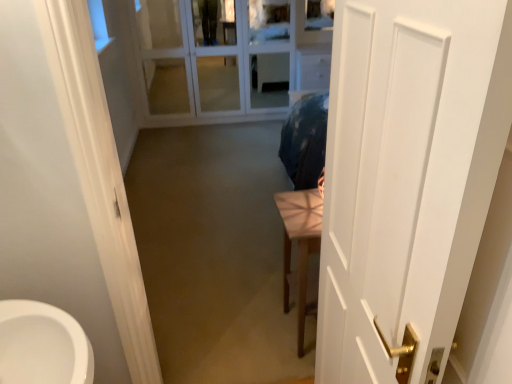
Question: Considering the relative positions of white matte door at right and light brown wooden table at center in the image provided, is white matte door at right in front of light brown wooden table at center?

Choices:
 (A) no
 (B) yes

Answer: (B)

Question: Considering the relative positions of white matte door at right and light brown wooden table at center in the image provided, is white matte door at right to the right of light brown wooden table at center from the viewer's perspective?

Choices:
 (A) no
 (B) yes

Answer: (B)

Question: Is light brown wooden table at center located within white matte door at right?

Choices:
 (A) yes
 (B) no

Answer: (B)

Question: From a real-world perspective, is white matte door at right positioned under light brown wooden table at center based on gravity?

Choices:
 (A) no
 (B) yes

Answer: (A)

Question: Can you confirm if white matte door at right is positioned to the left of light brown wooden table at center?

Choices:
 (A) yes
 (B) no

Answer: (B)

Question: Is light brown wooden table at center inside or outside of white glass door at upper center?

Choices:
 (A) outside
 (B) inside

Answer: (A)

Question: Is light brown wooden table at center wider or thinner than white glass door at upper center?

Choices:
 (A) thin
 (B) wide

Answer: (B)

Question: Relative to white glass door at upper center, is light brown wooden table at center in front or behind?

Choices:
 (A) behind
 (B) front

Answer: (B)

Question: Based on their sizes in the image, would you say light brown wooden table at center is bigger or smaller than white glass door at upper center?

Choices:
 (A) small
 (B) big

Answer: (A)

Question: Is white matte door at right inside the boundaries of light brown wooden table at center, or outside?

Choices:
 (A) outside
 (B) inside

Answer: (A)

Question: Is point (418, 84) closer or farther from the camera than point (318, 223)?

Choices:
 (A) closer
 (B) farther

Answer: (A)

Question: Based on their sizes in the image, would you say white matte door at right is bigger or smaller than light brown wooden table at center?

Choices:
 (A) big
 (B) small

Answer: (B)

Question: In terms of height, does white matte door at right look taller or shorter compared to light brown wooden table at center?

Choices:
 (A) tall
 (B) short

Answer: (A)

Question: Based on their sizes in the image, would you say white glass door at upper center is bigger or smaller than light brown wooden table at center?

Choices:
 (A) small
 (B) big

Answer: (B)

Question: From the image's perspective, is white glass door at upper center positioned above or below light brown wooden table at center?

Choices:
 (A) below
 (B) above

Answer: (B)